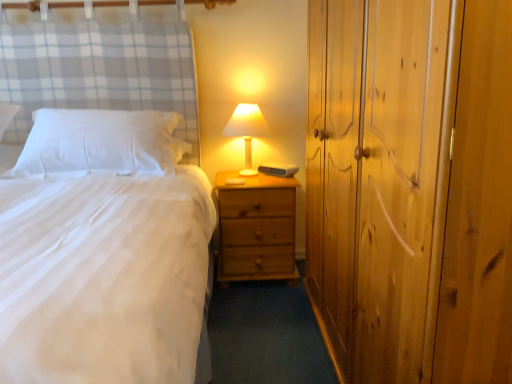
Find the location of a particular element. The width and height of the screenshot is (512, 384). matte white lampshade at center is located at coordinates (247, 130).

This screenshot has height=384, width=512. What do you see at coordinates (101, 142) in the screenshot?
I see `white soft pillow at left` at bounding box center [101, 142].

Image resolution: width=512 pixels, height=384 pixels. Find the location of `matte white lampshade at center`. matte white lampshade at center is located at coordinates (247, 130).

From a real-world perspective, does wooden dresser at right sit lower than natural wood nightstand at center?

No, from a real-world perspective, wooden dresser at right is not below natural wood nightstand at center.

Which is less distant, (399,7) or (279,251)?

The point (399,7) is closer to the camera.

Is wooden dresser at right oriented away from natural wood nightstand at center?

That's not correct — wooden dresser at right is not looking away from natural wood nightstand at center.

Would you say wooden dresser at right is to the left or to the right of natural wood nightstand at center in the picture?

wooden dresser at right is to the right of natural wood nightstand at center.

From the image's perspective, relative to white soft pillow at left, is natural wood nightstand at center above or below?

Based on their image positions, natural wood nightstand at center is located beneath white soft pillow at left.

From the picture: What's the angular difference between natural wood nightstand at center and white soft pillow at left's facing directions?

2.29 degrees separate the facing orientations of natural wood nightstand at center and white soft pillow at left.

Is natural wood nightstand at center oriented away from white soft pillow at left?

natural wood nightstand at center is not turned away from white soft pillow at left.

Consider the image. Would you say white matte bed at center is a long distance from matte white lampshade at center?

No, white matte bed at center is not far away from matte white lampshade at center.

Does white matte bed at center appear on the right side of matte white lampshade at center?

No, white matte bed at center is not to the right of matte white lampshade at center.

From the image's perspective, is white matte bed at center under matte white lampshade at center?

Yes, from the image's perspective, white matte bed at center is below matte white lampshade at center.

Where is `bed below the matte white lampshade at center (from the image's perspective)`? Image resolution: width=512 pixels, height=384 pixels. bed below the matte white lampshade at center (from the image's perspective) is located at coordinates (102, 251).

Based on the photo, from the image's perspective, is white matte bed at center positioned above or below wooden dresser at right?

white matte bed at center is above wooden dresser at right.

Is white matte bed at center wider than wooden dresser at right?

Yes, white matte bed at center is wider than wooden dresser at right.

How much distance is there between white matte bed at center and wooden dresser at right?

The distance of white matte bed at center from wooden dresser at right is 28.21 inches.

From a real-world perspective, between white matte bed at center and wooden dresser at right, who is vertically higher?

white matte bed at center, from a real-world perspective.

Considering the sizes of objects white soft pillow at left and wooden dresser at right in the image provided, who is wider, white soft pillow at left or wooden dresser at right?

wooden dresser at right is wider.

Where is `pillow located on the left of wooden dresser at right`? The image size is (512, 384). pillow located on the left of wooden dresser at right is located at coordinates (101, 142).

Can you confirm if white soft pillow at left is shorter than wooden dresser at right?

Correct, white soft pillow at left is not as tall as wooden dresser at right.

Is white soft pillow at left spatially inside wooden dresser at right, or outside of it?

white soft pillow at left is not enclosed by wooden dresser at right.

From the picture: Is matte white lampshade at center to the left or to the right of wooden dresser at right in the image?

From the image, it's evident that matte white lampshade at center is to the left of wooden dresser at right.

Is matte white lampshade at center in contact with wooden dresser at right?

There is a gap between matte white lampshade at center and wooden dresser at right.

How many degrees apart are the facing directions of matte white lampshade at center and wooden dresser at right?

matte white lampshade at center and wooden dresser at right are facing 89.7 degrees away from each other.

Where is `table lamp lying on the left of wooden dresser at right`? table lamp lying on the left of wooden dresser at right is located at coordinates [x=247, y=130].

Consider the image. Is white matte bed at center inside the boundaries of natural wood nightstand at center, or outside?

white matte bed at center is outside natural wood nightstand at center.

Would you say white matte bed at center is to the left or to the right of natural wood nightstand at center in the picture?

Based on their positions, white matte bed at center is located to the left of natural wood nightstand at center.

From their relative heights in the image, would you say white matte bed at center is taller or shorter than natural wood nightstand at center?

white matte bed at center is taller than natural wood nightstand at center.

Where is `nightstand behind the wooden dresser at right`? The width and height of the screenshot is (512, 384). nightstand behind the wooden dresser at right is located at coordinates (256, 228).

Find the location of a particular element. pillow above the natural wood nightstand at center (from the image's perspective) is located at coordinates click(x=101, y=142).

Which object lies further to the anchor point matte white lampshade at center, white matte bed at center or natural wood nightstand at center?

white matte bed at center.

Looking at the image, which one is located further to natural wood nightstand at center, white matte bed at center or wooden dresser at right?

wooden dresser at right lies further to natural wood nightstand at center than the other object.

In the scene shown: Looking at the image, which one is located further to white soft pillow at left, matte white lampshade at center or natural wood nightstand at center?

The object further to white soft pillow at left is matte white lampshade at center.

From the image, which object appears to be nearer to white soft pillow at left, natural wood nightstand at center or wooden dresser at right?

The object closer to white soft pillow at left is natural wood nightstand at center.

Estimate the real-world distances between objects in this image. Which object is further from wooden dresser at right, white soft pillow at left or natural wood nightstand at center?

white soft pillow at left lies further to wooden dresser at right than the other object.

Considering their positions, is matte white lampshade at center positioned closer to wooden dresser at right than natural wood nightstand at center?

Among the two, natural wood nightstand at center is located nearer to wooden dresser at right.

Based on their spatial positions, is white soft pillow at left or wooden dresser at right further from matte white lampshade at center?

Based on the image, wooden dresser at right appears to be further to matte white lampshade at center.

Looking at the image, which one is located closer to white soft pillow at left, matte white lampshade at center or white matte bed at center?

white matte bed at center.

Locate an element on the screen. The width and height of the screenshot is (512, 384). table lamp situated between white soft pillow at left and natural wood nightstand at center from left to right is located at coordinates (247, 130).

Identify the location of dresser between white matte bed at center and matte white lampshade at center along the z-axis. (411, 188).

Find the location of a particular element. This screenshot has width=512, height=384. pillow between wooden dresser at right and matte white lampshade at center along the z-axis is located at coordinates (101, 142).

The image size is (512, 384). What are the coordinates of `pillow located between wooden dresser at right and natural wood nightstand at center in the depth direction` in the screenshot? It's located at (101, 142).